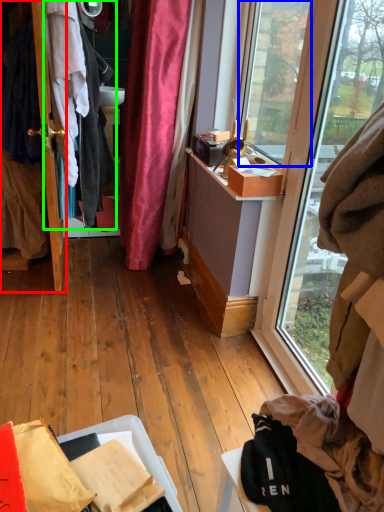
Question: Estimate the real-world distances between objects in this image. Which object is farther from door (highlighted by a red box), window screen (highlighted by a blue box) or clothing (highlighted by a green box)?

Choices:
 (A) window screen
 (B) clothing

Answer: (A)